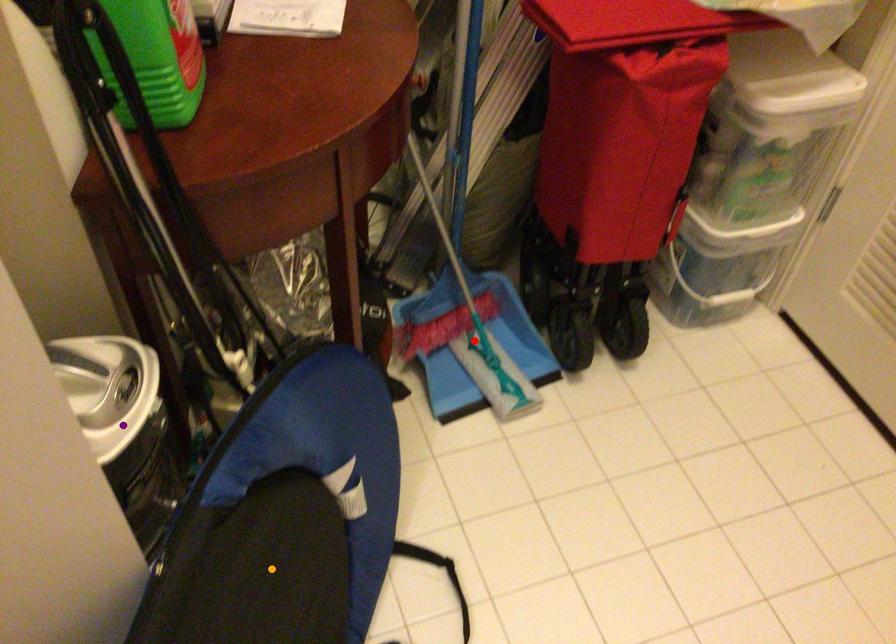
Order these from nearest to farthest:
red point, purple point, orange point

purple point → orange point → red point